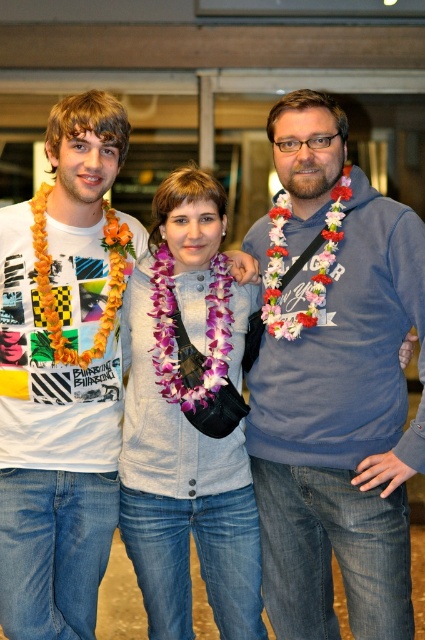
Can you confirm if blue fleece sweater at center is thinner than matte white t-shirt at left?

In fact, blue fleece sweater at center might be wider than matte white t-shirt at left.

Between point (354, 605) and point (53, 600), which one is positioned behind?

Point (53, 600)

Between point (396, 628) and point (73, 387), which one is positioned in front?

Positioned in front is point (396, 628).

At what (x,y) coordinates should I click in order to perform the action: click on blue fleece sweater at center. Please return your answer as a coordinate pair (x, y). This screenshot has height=640, width=425. Looking at the image, I should click on (334, 385).